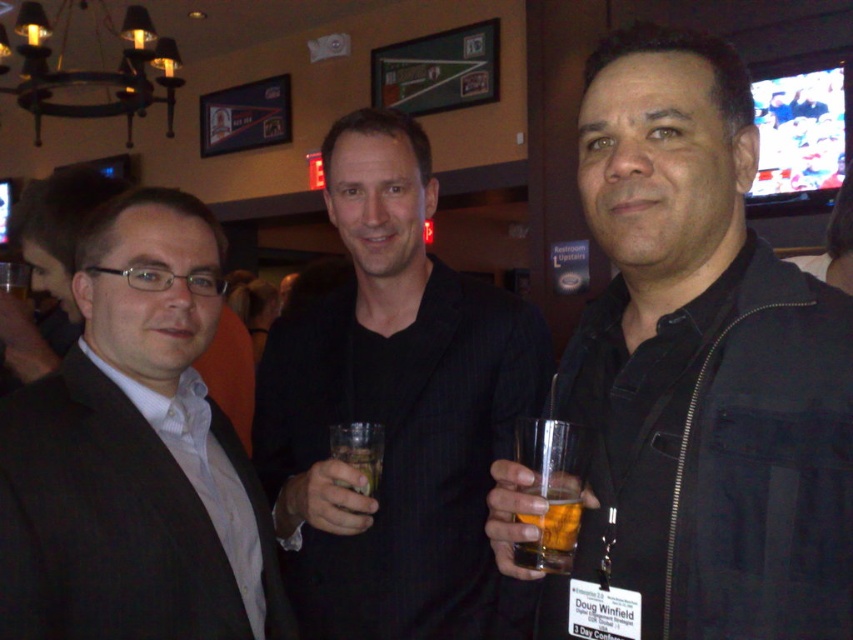
Question: Which object is farther from the camera taking this photo?

Choices:
 (A) clear glass at center
 (B) matte black suit at left
 (C) translucent glass at center

Answer: (A)

Question: Can you confirm if black matte jacket at center is bigger than translucent glass at right?

Choices:
 (A) yes
 (B) no

Answer: (A)

Question: Considering the real-world distances, which object is closest to the matte black suit at left?

Choices:
 (A) translucent glass at right
 (B) black pinstripe suit at center
 (C) black matte jacket at center
 (D) translucent glass at center

Answer: (B)

Question: Is translucent glass at right bigger than clear glass at center?

Choices:
 (A) yes
 (B) no

Answer: (B)

Question: Among these points, which one is nearest to the camera?

Choices:
 (A) (368, 445)
 (B) (578, 438)
 (C) (108, 260)
 (D) (701, 417)

Answer: (D)

Question: Is black pinstripe suit at center further to the viewer compared to translucent glass at center?

Choices:
 (A) yes
 (B) no

Answer: (A)